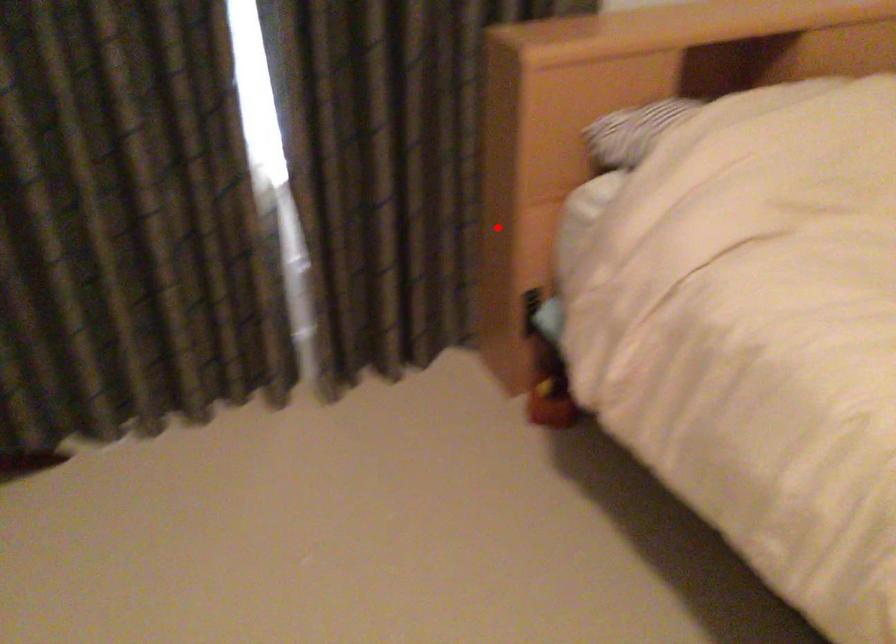
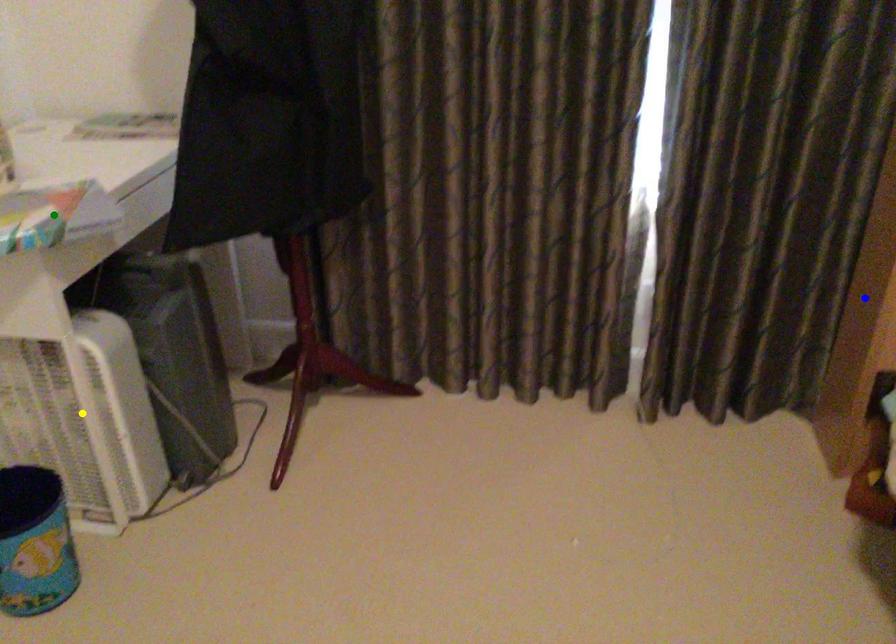
Question: I am providing you with two images of the same scene from different viewpoints. A red point is marked on the first image. You are given multiple points on the second image. Which mark in image 2 goes with the point in image 1?

Choices:
 (A) yellow point
 (B) blue point
 (C) green point

Answer: (B)